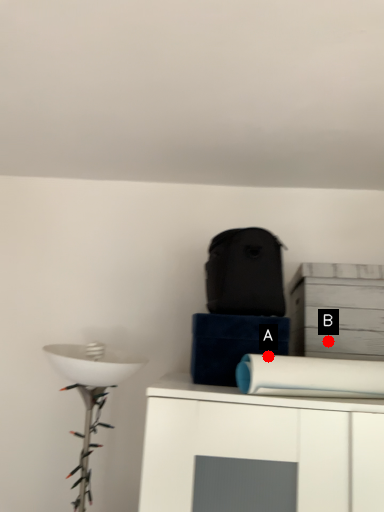
Question: Two points are circled on the image, labeled by A and B beside each circle. Which point is further to the camera?

Choices:
 (A) A is further
 (B) B is further

Answer: (B)